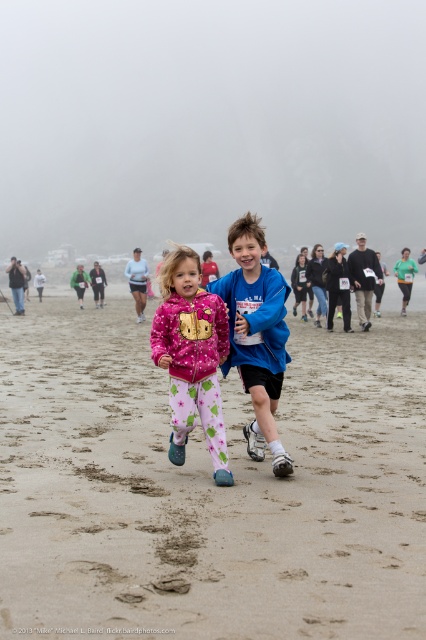
Question: Which point is farther from the camera taking this photo?

Choices:
 (A) tap(215, 428)
 (B) tap(298, 449)

Answer: (B)

Question: Which of the following is the farthest from the observer?

Choices:
 (A) sandy beach at center
 (B) blue fleece jacket at center
 (C) pink fleece jacket at center

Answer: (B)

Question: Which of the following is the farthest from the observer?

Choices:
 (A) pink fleece jacket at center
 (B) blue fleece jacket at center
 (C) sandy beach at center

Answer: (B)

Question: From the image, what is the correct spatial relationship of pink fleece jacket at center in relation to blue fleece jacket at center?

Choices:
 (A) below
 (B) above

Answer: (A)

Question: Is the position of sandy beach at center more distant than that of blue fleece jacket at center?

Choices:
 (A) yes
 (B) no

Answer: (B)

Question: Does sandy beach at center appear on the right side of pink fleece jacket at center?

Choices:
 (A) no
 (B) yes

Answer: (B)